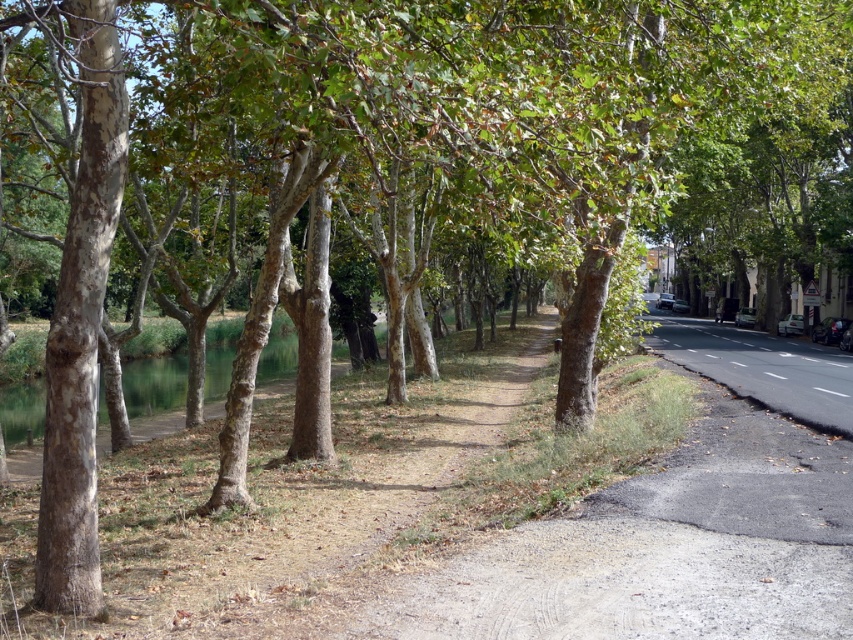
Question: Does dirt/gravel path at center have a smaller size compared to white asphalt line at road center?

Choices:
 (A) no
 (B) yes

Answer: (A)

Question: Among these points, which one is nearest to the camera?

Choices:
 (A) (740, 396)
 (B) (698, 349)
 (C) (814, 388)

Answer: (A)

Question: Does dirt/gravel path at center have a lesser width compared to black asphalt road at right?

Choices:
 (A) yes
 (B) no

Answer: (A)

Question: Which point is closer to the camera?

Choices:
 (A) dirt/gravel path at center
 (B) white asphalt line at road center

Answer: (A)

Question: Does dirt/gravel path at center have a larger size compared to black asphalt road at right?

Choices:
 (A) yes
 (B) no

Answer: (B)

Question: Which object is closer to the camera taking this photo?

Choices:
 (A) dirt/gravel path at center
 (B) black asphalt road at right

Answer: (A)